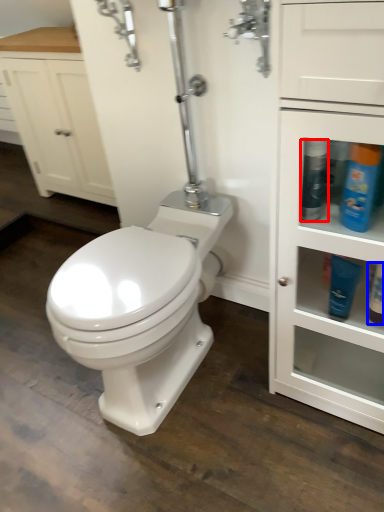
Question: Which of the following is the farthest to the observer, cleaning product (highlighted by a red box) or toiletry (highlighted by a blue box)?

Choices:
 (A) cleaning product
 (B) toiletry

Answer: (B)